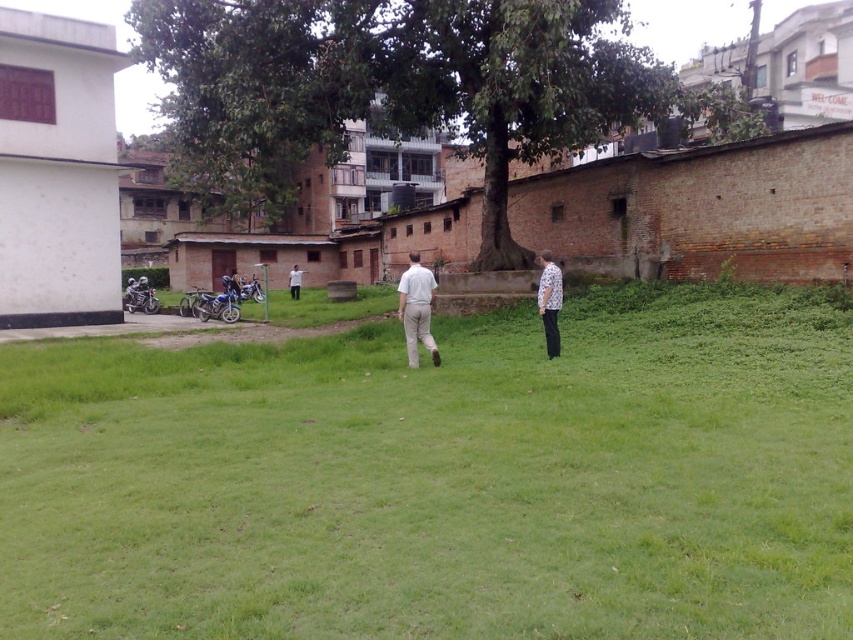
Is green grass at center to the left of white printed shirt at right from the viewer's perspective?

Correct, you'll find green grass at center to the left of white printed shirt at right.

Between green grass at center and white printed shirt at right, which one has less height?

Standing shorter between the two is green grass at center.

This screenshot has width=853, height=640. What do you see at coordinates (442, 477) in the screenshot?
I see `green grass at center` at bounding box center [442, 477].

Where is `green grass at center`? Image resolution: width=853 pixels, height=640 pixels. green grass at center is located at coordinates (442, 477).

Who is higher up, green grass at center or white shirt at center?

white shirt at center is higher up.

Who is positioned more to the left, green grass at center or white shirt at center?

white shirt at center

Is point (700, 634) positioned in front of point (296, 269)?

Yes, it is in front of point (296, 269).

The height and width of the screenshot is (640, 853). Find the location of `green grass at center`. green grass at center is located at coordinates (442, 477).

Consider the image. Which is more to the right, white matte pants at center or white shirt at center?

Positioned to the right is white matte pants at center.

Is point (430, 285) positioned after point (289, 292)?

No, (430, 285) is in front of (289, 292).

Is point (422, 314) in front of point (300, 280)?

Yes.

Identify the location of white matte pants at center. (416, 308).